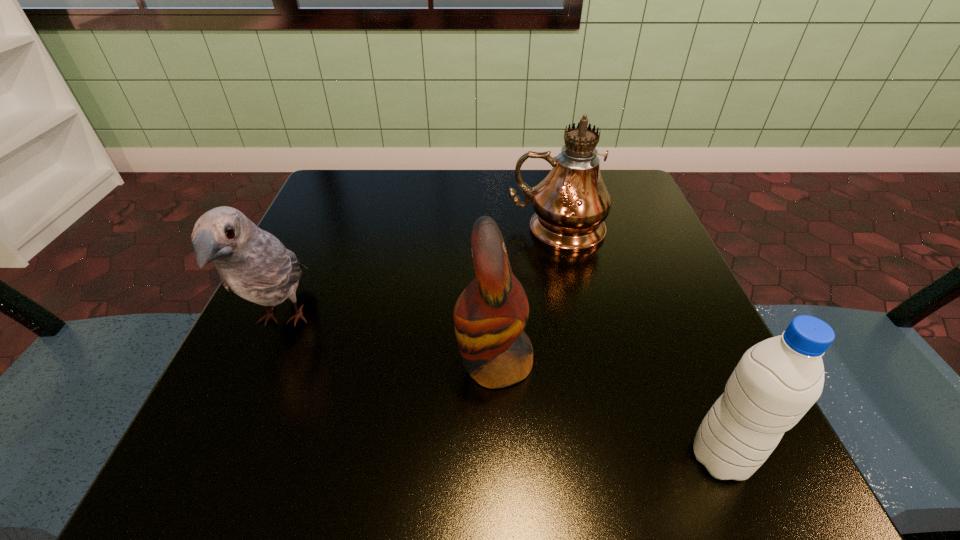
The height and width of the screenshot is (540, 960). Find the location of `vacant space located on the front-facing side of the left parrot`. vacant space located on the front-facing side of the left parrot is located at coordinates (207, 488).

Where is `vacant space situated 0.310m on the back of the nearest object`? vacant space situated 0.310m on the back of the nearest object is located at coordinates (643, 273).

In order to click on object located in the far edge section of the desktop in this screenshot , I will do `click(571, 203)`.

Where is `object located at the near edge`? This screenshot has width=960, height=540. object located at the near edge is located at coordinates (775, 383).

Find the location of `object that is positioned at the left edge`. object that is positioned at the left edge is located at coordinates (253, 263).

This screenshot has height=540, width=960. Identify the location of oil lamp at the right edge. (571, 203).

Find the location of a particular element. water bottle that is positioned at the right edge is located at coordinates (775, 383).

What are the coordinates of `object situated at the far right corner` in the screenshot? It's located at (571, 203).

The width and height of the screenshot is (960, 540). Find the location of `object located in the near right corner section of the desktop`. object located in the near right corner section of the desktop is located at coordinates (775, 383).

At what (x,y) coordinates should I click in order to perform the action: click on vacant space at the far edge of the desktop. Please return your answer as a coordinate pair (x, y). This screenshot has height=540, width=960. Looking at the image, I should click on (522, 207).